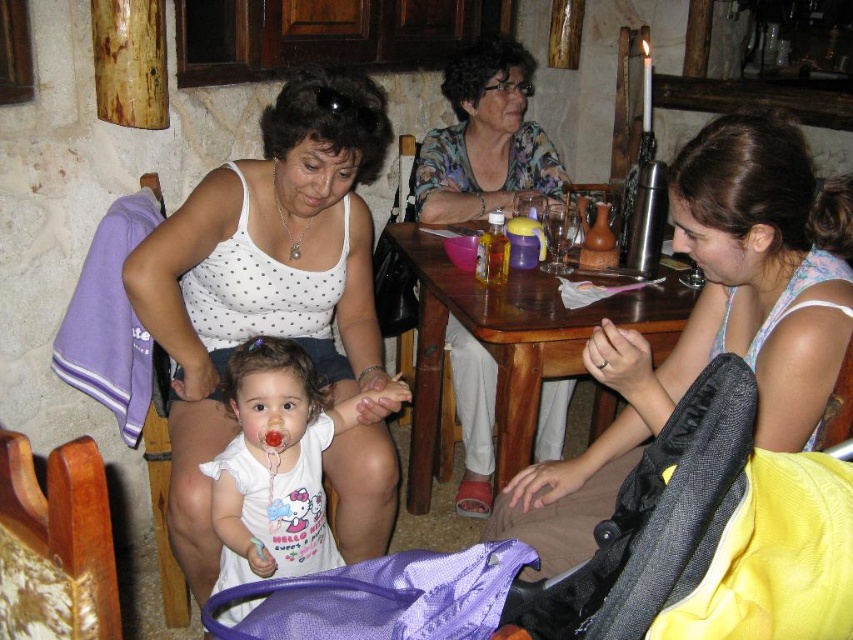
Question: Is wooden table at center bigger than floral fabric blouse at upper center?

Choices:
 (A) no
 (B) yes

Answer: (B)

Question: Based on their relative distances, which object is farther from the wooden table at center?

Choices:
 (A) floral fabric blouse at upper center
 (B) white cotton shirt at center
 (C) matte white tank top at center

Answer: (A)

Question: From the image, what is the correct spatial relationship of white dotted tank top at center in relation to white cotton shirt at center?

Choices:
 (A) right
 (B) left

Answer: (B)

Question: Which object is positioned closest to the floral fabric blouse at upper center?

Choices:
 (A) white cotton shirt at center
 (B) white dotted tank top at center
 (C) wooden table at center
 (D) matte white tank top at center

Answer: (C)

Question: Which is farther from the white cotton shirt at center?

Choices:
 (A) wooden table at center
 (B) white dotted tank top at center
 (C) matte white tank top at center
 (D) floral fabric blouse at upper center

Answer: (D)

Question: Is matte white tank top at center thinner than floral fabric blouse at upper center?

Choices:
 (A) no
 (B) yes

Answer: (A)